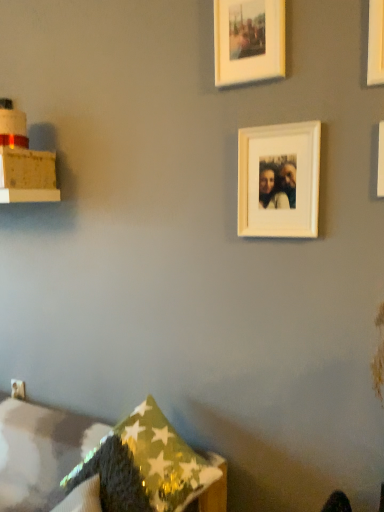
Question: Visually, is green textured pillow at lower left, arranged as the second pillow when viewed from the back, positioned to the left or to the right of shiny metallic pillow at lower center, the first pillow when ordered from back to front?

Choices:
 (A) right
 (B) left

Answer: (B)

Question: Is green textured pillow at lower left, arranged as the second pillow when viewed from the back, wider or thinner than shiny metallic pillow at lower center, marked as the 2th pillow in a front-to-back arrangement?

Choices:
 (A) wide
 (B) thin

Answer: (B)

Question: Estimate the real-world distances between objects in this image. Which object is closer to the white matte picture frame at upper center, the 1th picture frame when ordered from bottom to top?

Choices:
 (A) white matte picture frame at upper center, the 3th picture frame in the right-to-left sequence
 (B) green textured pillow at lower left, the 1th pillow viewed from the front
 (C) white matte picture frame at upper right, which appears as the 2th picture frame when viewed from the top
 (D) shiny metallic pillow at lower center, marked as the 2th pillow in a front-to-back arrangement

Answer: (C)

Question: Which is farther from the white matte picture frame at upper center, the 1th picture frame when ordered from bottom to top?

Choices:
 (A) green textured pillow at lower left, the 1th pillow viewed from the front
 (B) white matte picture frame at upper center, the 3th picture frame in the right-to-left sequence
 (C) shiny metallic pillow at lower center, the first pillow when ordered from back to front
 (D) white matte picture frame at upper right, positioned as the second picture frame in bottom-to-top order

Answer: (A)